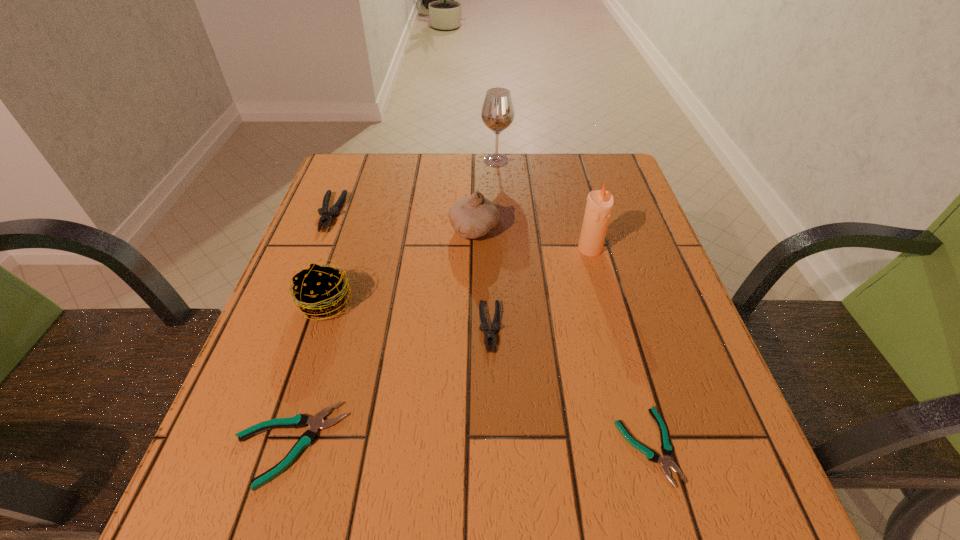
At what (x,y) coordinates should I click in order to perform the action: click on free space that satisfies the following two spatial constraints: 1. on the back side of the second shortest pliers; 2. on the right side of the candle. Please return your answer as a coordinate pair (x, y). This screenshot has width=960, height=540. Looking at the image, I should click on (349, 249).

You are a GUI agent. You are given a task and a screenshot of the screen. Output one action in this format:
    pyautogui.click(x=<x>, y=<y>)
    Task: Click on the vacant space that satisfies the following two spatial constraints: 1. at the gripping part of the right teal pliers; 2. on the left side of the third nearest pliers
    
    Given the screenshot: What is the action you would take?
    pyautogui.click(x=492, y=446)

Locate an element on the screen. free point that satisfies the following two spatial constraints: 1. at the gripping part of the patty; 2. on the right side of the left gray pliers is located at coordinates (296, 302).

Find the location of `free point that satisfies the following two spatial constraints: 1. on the front side of the smaller teal pliers; 2. on the left side of the sixth shortest object`. free point that satisfies the following two spatial constraints: 1. on the front side of the smaller teal pliers; 2. on the left side of the sixth shortest object is located at coordinates (470, 446).